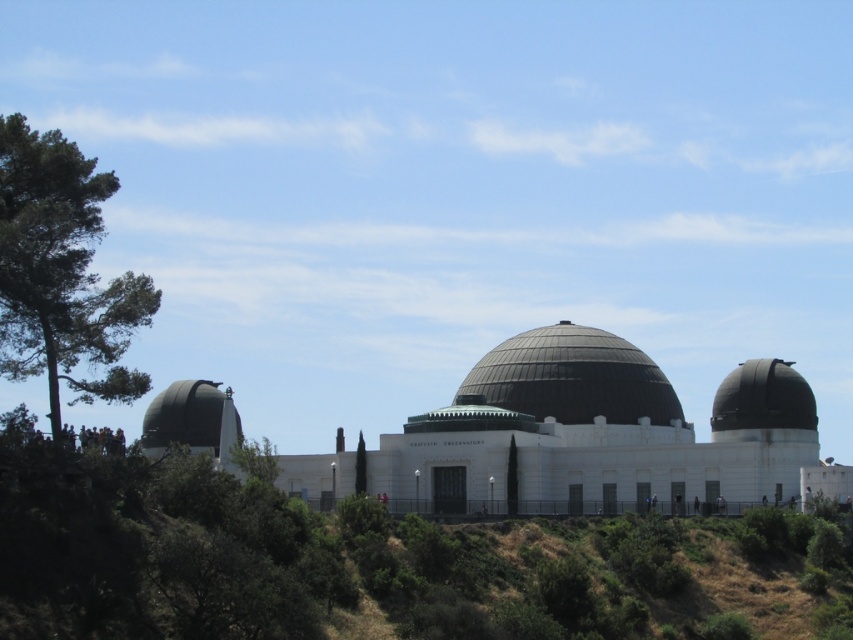
Question: Does green textured tree at left have a smaller size compared to shiny black dome at right?

Choices:
 (A) no
 (B) yes

Answer: (A)

Question: Which point is farther to the camera?

Choices:
 (A) matte gray dome at left
 (B) shiny dark gray dome at center

Answer: (B)

Question: Which of the following is the farthest from the observer?

Choices:
 (A) (186, 432)
 (B) (62, 332)

Answer: (A)

Question: Considering the real-world distances, which object is closest to the shiny dark gray dome at center?

Choices:
 (A) green textured tree at left
 (B) shiny black dome at right
 (C) matte gray dome at left

Answer: (B)

Question: Is the position of green textured tree at left more distant than that of shiny dark gray dome at center?

Choices:
 (A) no
 (B) yes

Answer: (A)

Question: Does shiny black dome at right come in front of matte gray dome at left?

Choices:
 (A) yes
 (B) no

Answer: (A)